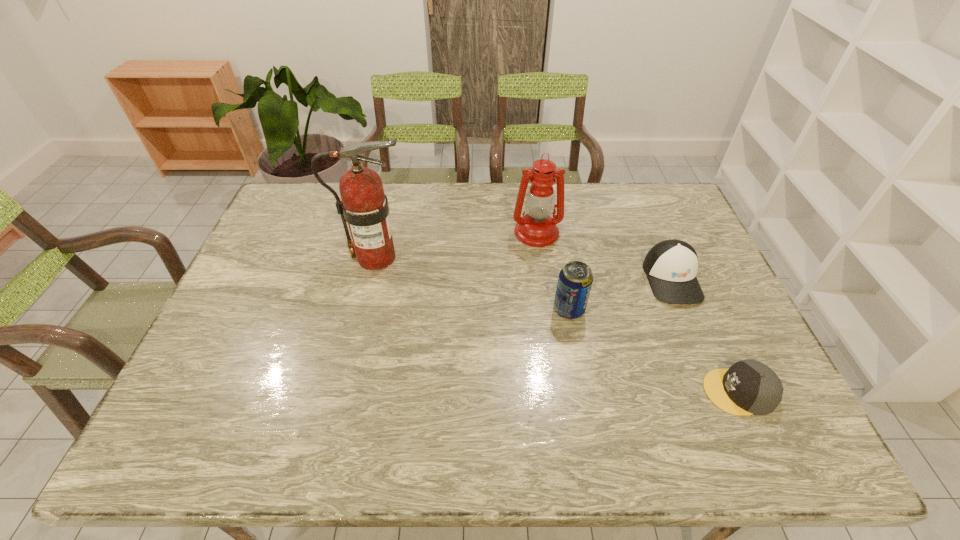
Image resolution: width=960 pixels, height=540 pixels. What are the coordinates of `free space between the leftmost object and the shortest object` in the screenshot? It's located at (558, 325).

At what (x,y) coordinates should I click in order to perform the action: click on vacant space in between the fourth shortest object and the farther cap. Please return your answer as a coordinate pair (x, y). This screenshot has width=960, height=540. Looking at the image, I should click on (604, 255).

Where is `object that is the closest to the soda`? The width and height of the screenshot is (960, 540). object that is the closest to the soda is located at coordinates (671, 266).

This screenshot has height=540, width=960. Identify the location of object that ranks as the fourth closest to the oil lamp. point(749,387).

Find the location of `blank space that satisfies the following two spatial constraints: 1. at the nozzle of the soda; 2. on the left side of the leftmost object`. blank space that satisfies the following two spatial constraints: 1. at the nozzle of the soda; 2. on the left side of the leftmost object is located at coordinates (364, 309).

The height and width of the screenshot is (540, 960). Find the location of `free point that satisfies the following two spatial constraints: 1. at the nozzle of the leftmost object; 2. on the left side of the third tallest object`. free point that satisfies the following two spatial constraints: 1. at the nozzle of the leftmost object; 2. on the left side of the third tallest object is located at coordinates (364, 309).

Find the location of a particular element. This screenshot has width=960, height=540. free region that satisfies the following two spatial constraints: 1. at the nozzle of the leftmost object; 2. on the left side of the third shortest object is located at coordinates (364, 309).